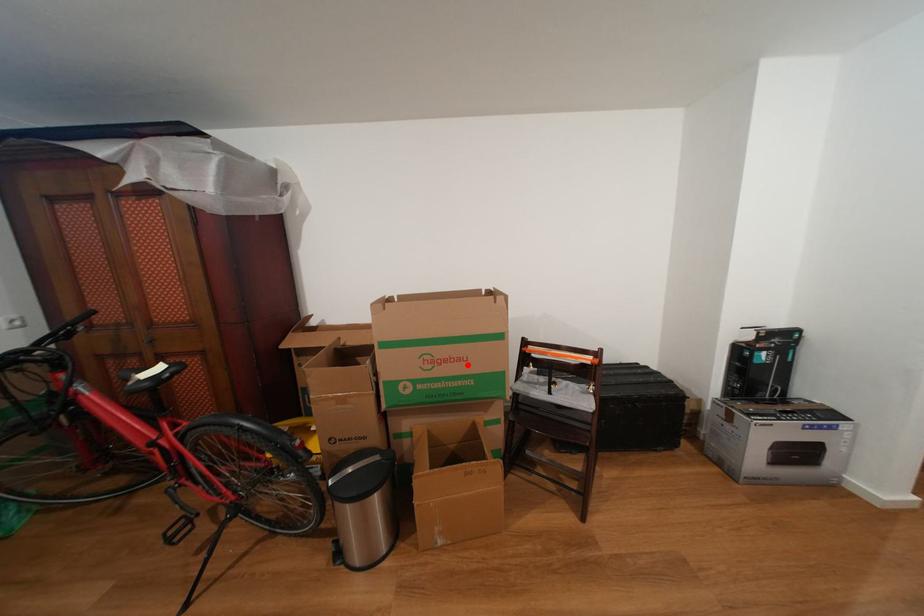
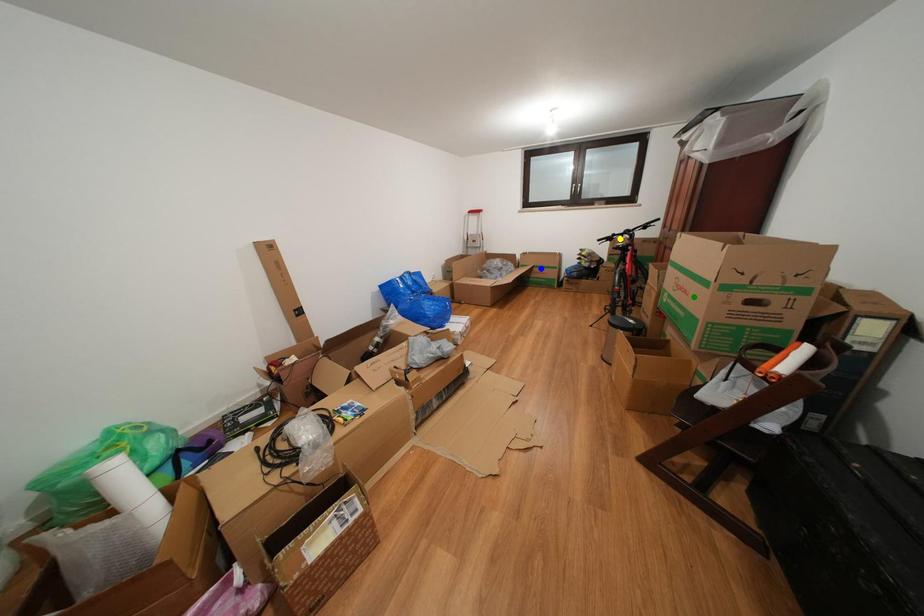
Question: I am providing you with two images of the same scene from different viewpoints. A red point is marked on the first image. You are given multiple points on the second image. Can you choose the point in image 2 that corresponds to the point in image 1?

Choices:
 (A) blue point
 (B) green point
 (C) yellow point

Answer: (B)